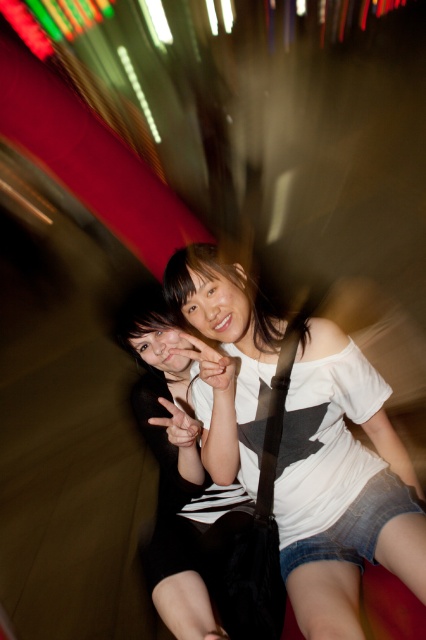
Is white matte shirt at center in front of black matte dress at center?

That is True.

Does white matte shirt at center have a greater width compared to black matte dress at center?

Yes.

Where is `white matte shirt at center`? The height and width of the screenshot is (640, 426). white matte shirt at center is located at coordinates (342, 486).

Where is `white matte shirt at center`? This screenshot has height=640, width=426. white matte shirt at center is located at coordinates click(x=342, y=486).